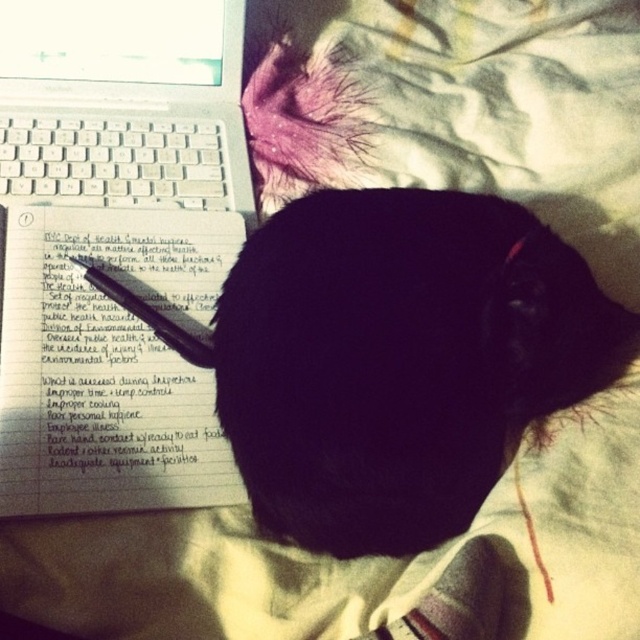
Where is `white plastic keyboard at upper left`? The height and width of the screenshot is (640, 640). white plastic keyboard at upper left is located at coordinates (115, 248).

How much distance is there between white plastic keyboard at upper left and black matte pen at upper left?

The distance of white plastic keyboard at upper left from black matte pen at upper left is 15.90 centimeters.

Where is `white plastic keyboard at upper left`? The image size is (640, 640). white plastic keyboard at upper left is located at coordinates (115, 248).

I want to click on white plastic keyboard at upper left, so click(x=115, y=248).

Is white plastic keyboard at upper left above black fur cat at center?

Yes.

Locate an element on the screen. white plastic keyboard at upper left is located at coordinates (115, 248).

Image resolution: width=640 pixels, height=640 pixels. In order to click on white plastic keyboard at upper left in this screenshot , I will do `click(115, 248)`.

Is the position of black fur cat at center more distant than that of black matte pen at upper left?

No, it is in front of black matte pen at upper left.

Can you confirm if black fur cat at center is shorter than black matte pen at upper left?

Result: No, black fur cat at center is not shorter than black matte pen at upper left.

Locate an element on the screen. The image size is (640, 640). black fur cat at center is located at coordinates (401, 360).